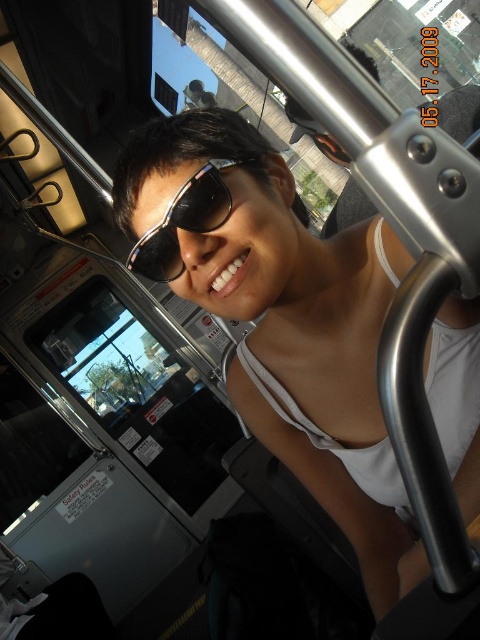
Does white matte tank top at center have a lesser height compared to sunglasses at center?

No, white matte tank top at center is not shorter than sunglasses at center.

Is white matte tank top at center to the left of sunglasses at center from the viewer's perspective?

In fact, white matte tank top at center is to the right of sunglasses at center.

Which is behind, point (206, 138) or point (144, 266)?

The point (144, 266) is behind.

The width and height of the screenshot is (480, 640). Find the location of `white matte tank top at center`. white matte tank top at center is located at coordinates (280, 317).